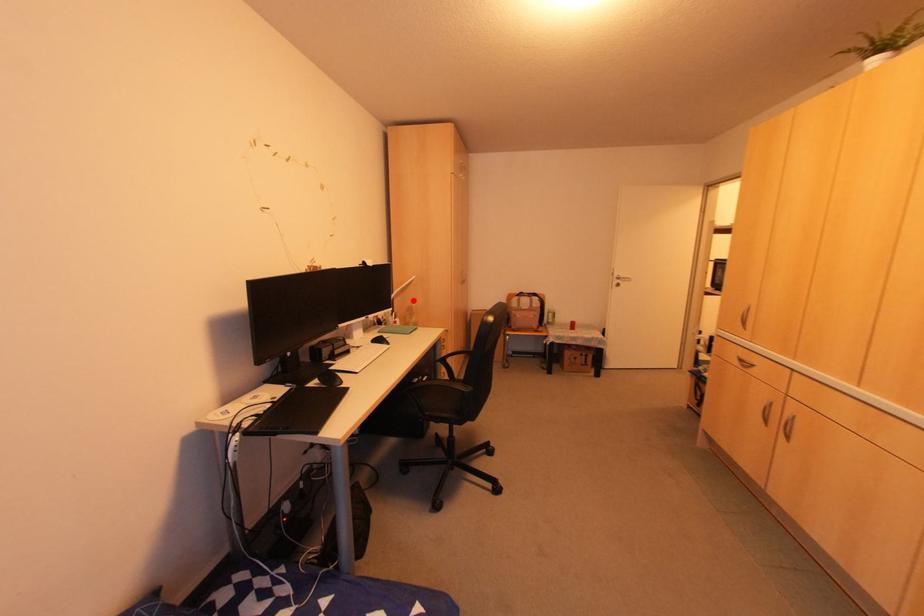
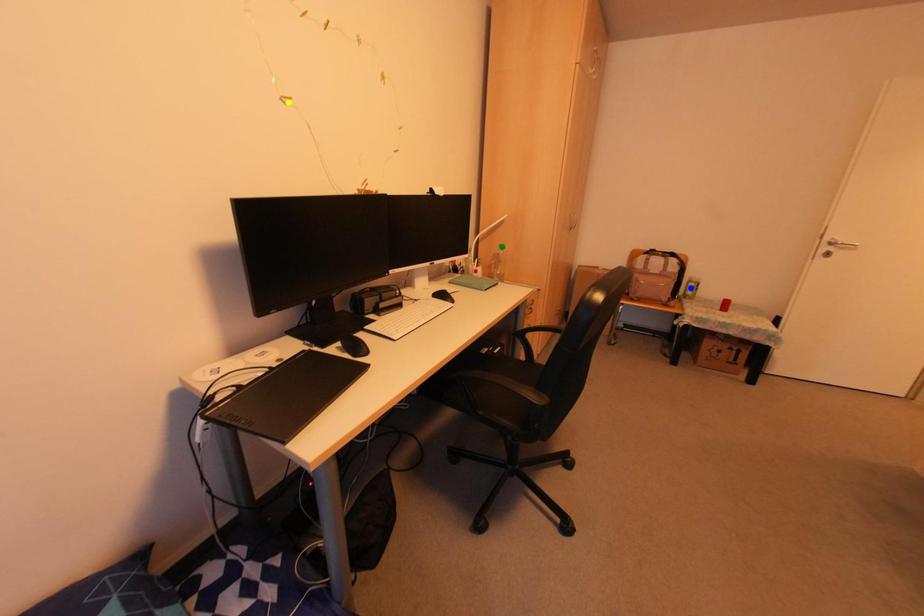
Question: I am providing you with two images of the same scene from different viewpoints. A red point is marked on the first image. You are given multiple points on the second image. Which mark in image 2 goes with the point in image 1?

Choices:
 (A) yellow point
 (B) blue point
 (C) green point

Answer: (C)